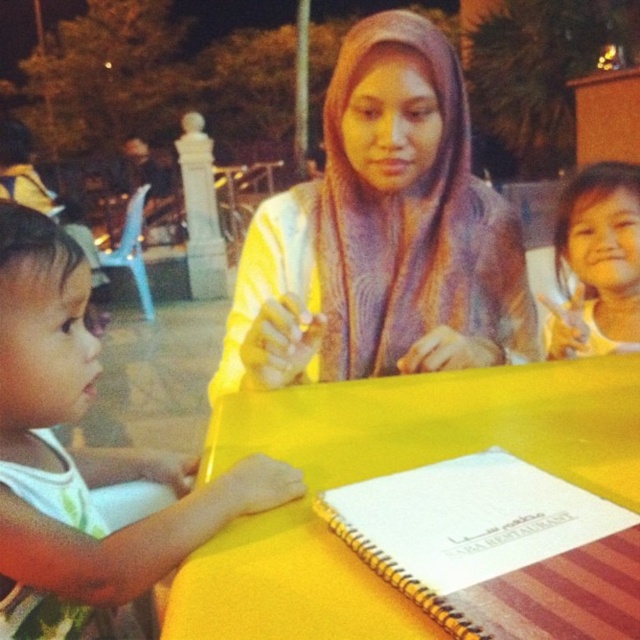
You are organizing a small evening event and need to know if there is enough space on the yellow table for both the white spiral notebook at center and the smooth white shirt at upper right. Based on the scene description, which item takes up more space?

The smooth white shirt at upper right occupies more space than the white spiral notebook at center.

You are a photographer trying to capture a closeup of the purple knitted scarf at center and the white spiral notebook at center. Since you want to focus on both objects clearly, which one should you adjust your camera focus to prioritize based on their sizes?

The purple knitted scarf at center is larger in size than the white spiral notebook at center, so you should prioritize focusing on the purple knitted scarf at center to ensure both are in focus as it takes up more space in the frame.